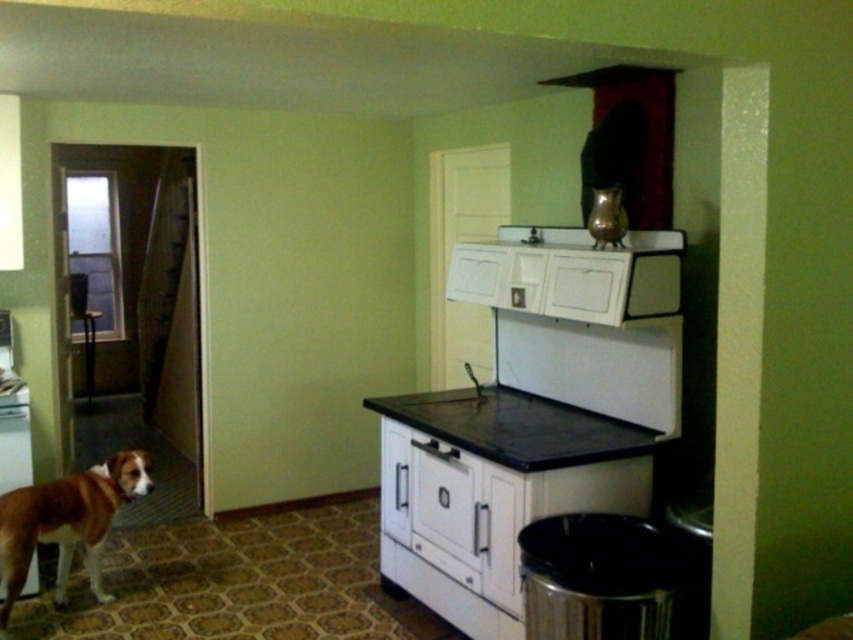
You are standing in the vintage kitchen and need to move from the stove to the cabinet above it. There are two points marked on the floor at coordinates point (498, 396) and point (28, 476). Which point is closer to the cabinet above the stove?

Point (498, 396) is behind point (28, 476), so the point closer to the cabinet above the stove would be point (28, 476) since it is in front.